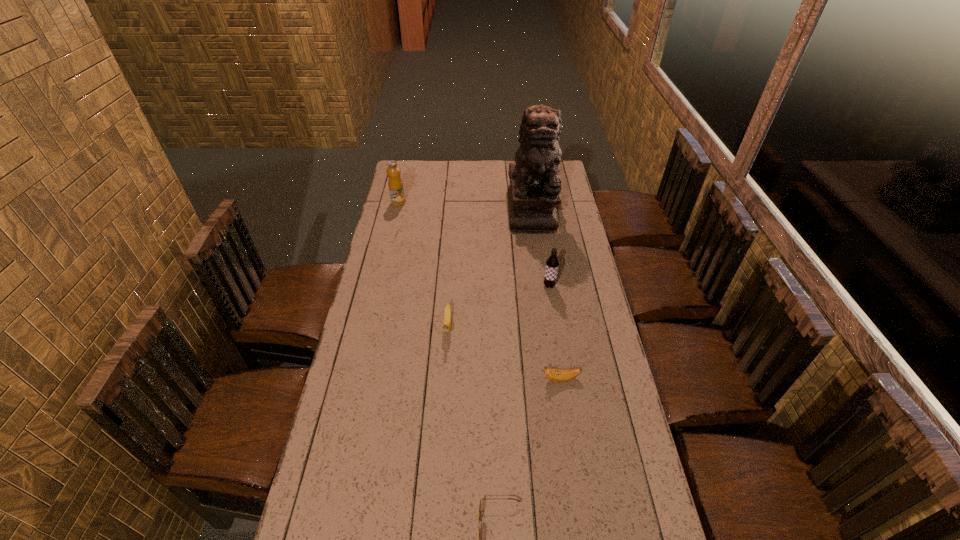
This screenshot has width=960, height=540. In order to click on sculpture in this screenshot , I will do `click(533, 194)`.

Image resolution: width=960 pixels, height=540 pixels. Identify the location of the leftmost object. (395, 184).

Locate an element on the screen. the third tallest object is located at coordinates (552, 263).

The image size is (960, 540). In order to click on root beer in this screenshot , I will do `click(552, 263)`.

Find the location of a particular element. This screenshot has height=540, width=960. the third nearest object is located at coordinates (446, 327).

This screenshot has width=960, height=540. I want to click on the left banana, so click(446, 327).

This screenshot has width=960, height=540. What are the coordinates of `the second nearest object` in the screenshot? It's located at click(x=558, y=375).

Locate an element on the screen. the nearer banana is located at coordinates (558, 375).

I want to click on vacant point located 0.270m on the front-facing side of the sculpture, so click(x=541, y=275).

This screenshot has height=540, width=960. I want to click on vacant region located 0.300m on the front label of the leftmost object, so click(467, 202).